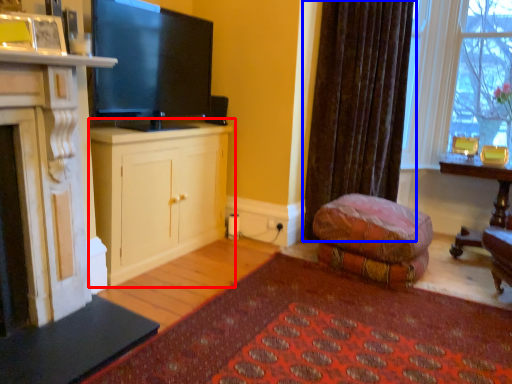
Question: Among these objects, which one is nearest to the camera, cabinetry (highlighted by a red box) or curtain (highlighted by a blue box)?

Choices:
 (A) cabinetry
 (B) curtain

Answer: (A)